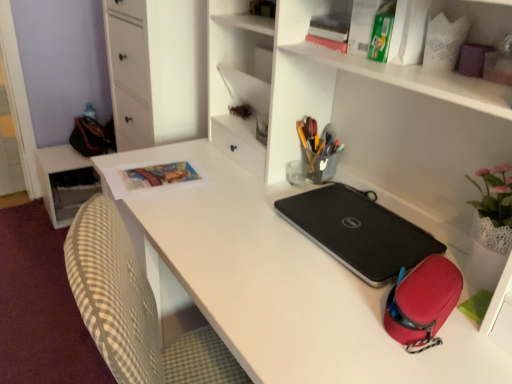
Question: Would you say black textured laptop at center is a long distance from white matte desk at center?

Choices:
 (A) yes
 (B) no

Answer: (B)

Question: From a real-world perspective, is black textured laptop at center located beneath white matte desk at center?

Choices:
 (A) no
 (B) yes

Answer: (A)

Question: Considering the relative sizes of black textured laptop at center and white matte desk at center in the image provided, is black textured laptop at center smaller than white matte desk at center?

Choices:
 (A) yes
 (B) no

Answer: (A)

Question: Is black textured laptop at center to the left of white matte desk at center from the viewer's perspective?

Choices:
 (A) yes
 (B) no

Answer: (B)

Question: Does black textured laptop at center lie behind white matte desk at center?

Choices:
 (A) yes
 (B) no

Answer: (A)

Question: Relative to black textured laptop at center, is white matte file cabinet at upper left in front or behind?

Choices:
 (A) front
 (B) behind

Answer: (B)

Question: Looking at their shapes, would you say white matte file cabinet at upper left is wider or thinner than black textured laptop at center?

Choices:
 (A) wide
 (B) thin

Answer: (A)

Question: Visually, is white matte file cabinet at upper left positioned to the left or to the right of black textured laptop at center?

Choices:
 (A) left
 (B) right

Answer: (A)

Question: From the image's perspective, relative to black textured laptop at center, is white matte file cabinet at upper left above or below?

Choices:
 (A) below
 (B) above

Answer: (B)

Question: Is white matte file cabinet at upper left to the left or to the right of metallic silver pen holder at center in the image?

Choices:
 (A) left
 (B) right

Answer: (A)

Question: Does point (167, 140) appear closer or farther from the camera than point (316, 162)?

Choices:
 (A) farther
 (B) closer

Answer: (A)

Question: In terms of width, does white matte file cabinet at upper left look wider or thinner when compared to metallic silver pen holder at center?

Choices:
 (A) wide
 (B) thin

Answer: (A)

Question: Considering their positions, is white matte file cabinet at upper left located in front of or behind metallic silver pen holder at center?

Choices:
 (A) front
 (B) behind

Answer: (B)

Question: Is white matte file cabinet at upper left wider or thinner than matte paper book at upper left?

Choices:
 (A) thin
 (B) wide

Answer: (B)

Question: Is white matte file cabinet at upper left spatially inside matte paper book at upper left, or outside of it?

Choices:
 (A) inside
 (B) outside

Answer: (B)